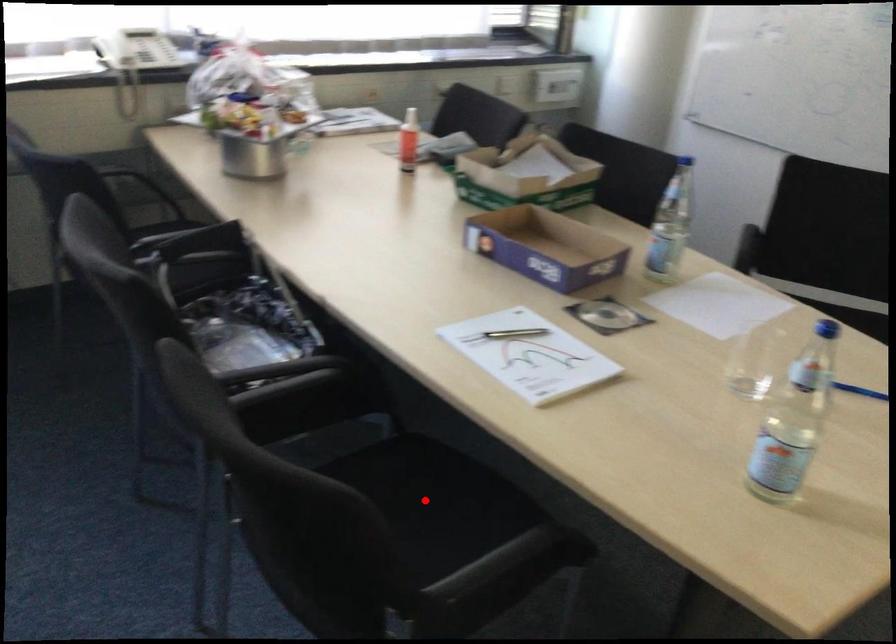
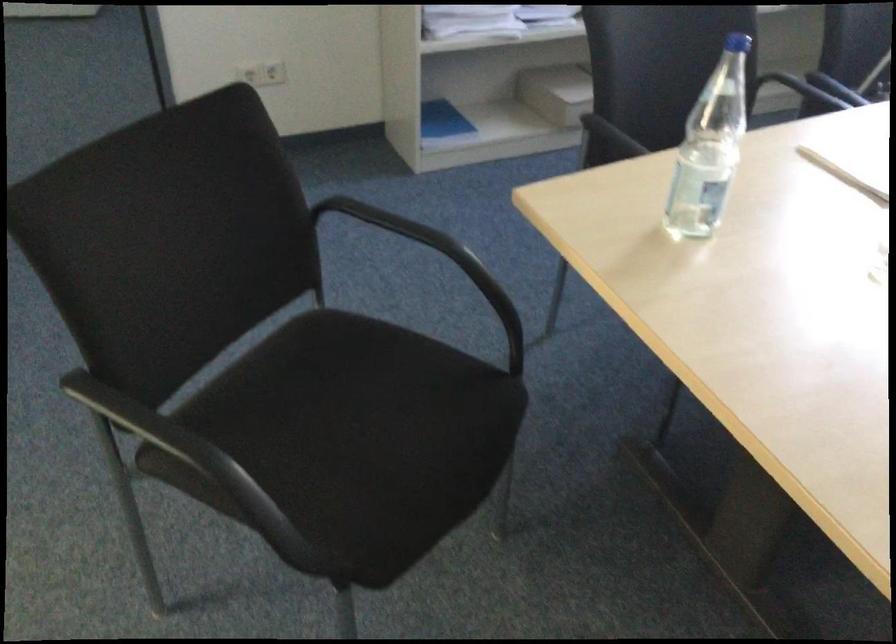
Question: I am providing you with two images of the same scene from different viewpoints. A red point is marked on the first image. Can you still see the location of the red point in image 2?

Choices:
 (A) Yes
 (B) No

Answer: (B)